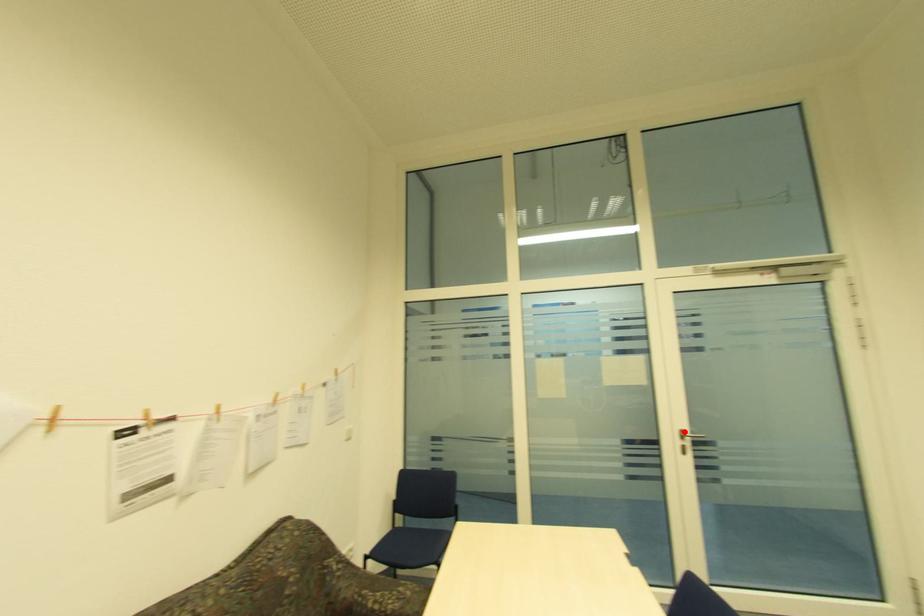
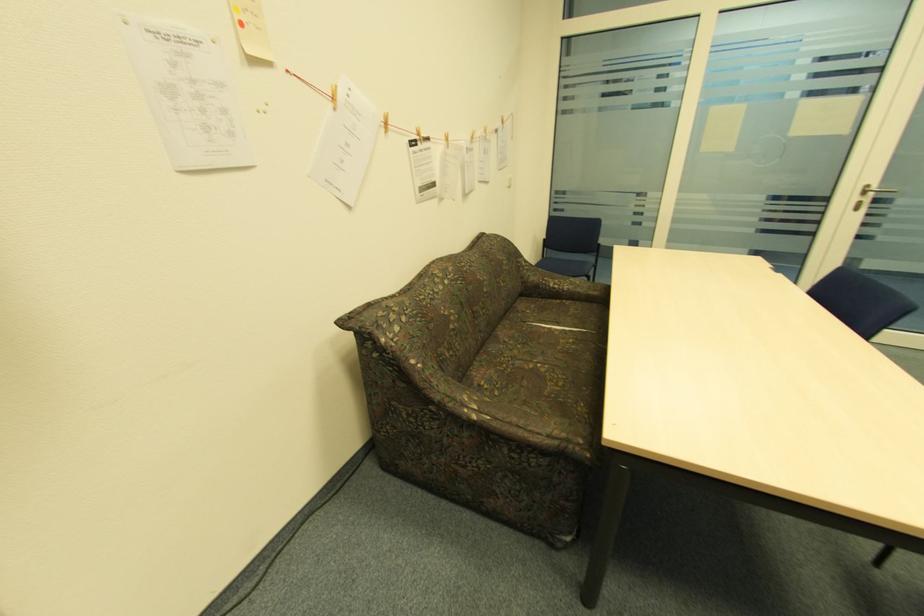
In the second image, find the point that corresponds to the highlighted location in the first image.

(870, 187)